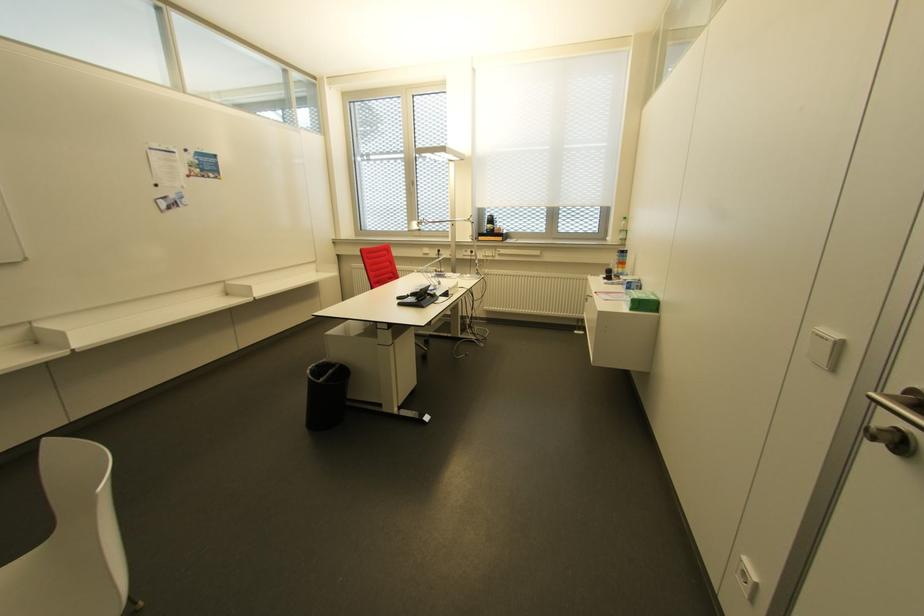
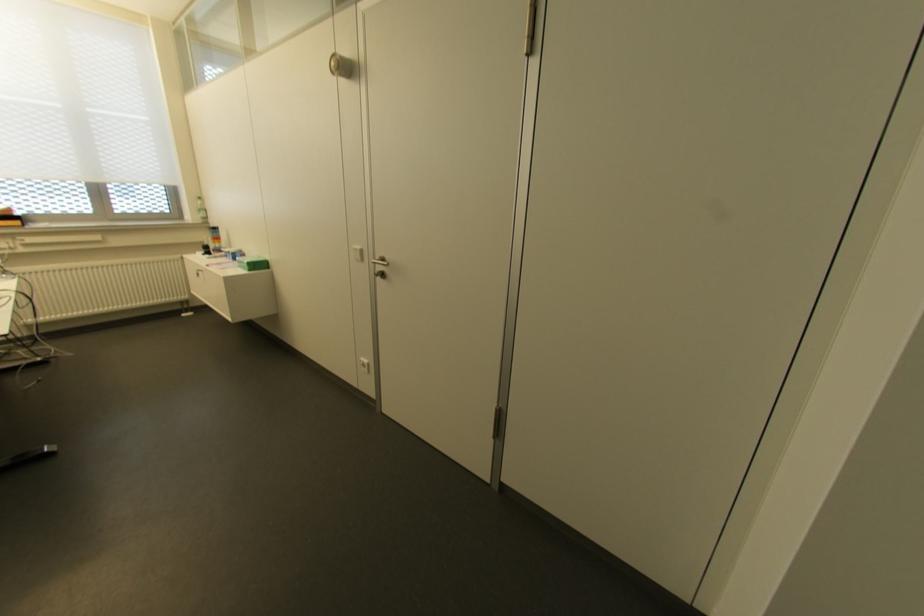
Question: The camera is either moving clockwise (left) or counter-clockwise (right) around the object. The first image is from the beginning of the video and the second image is from the end. Is the camera moving left or right when shooting the video?

Choices:
 (A) Left
 (B) Right

Answer: (A)